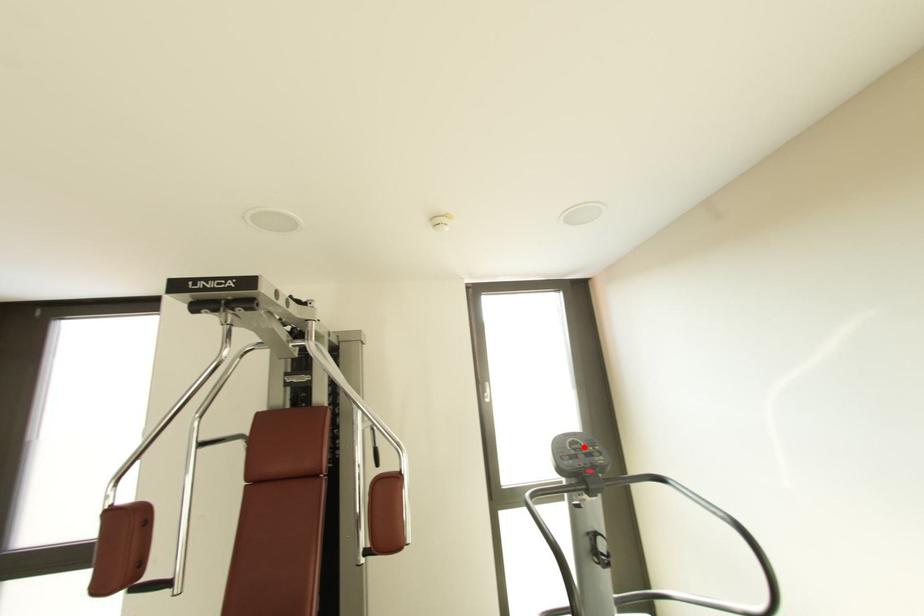
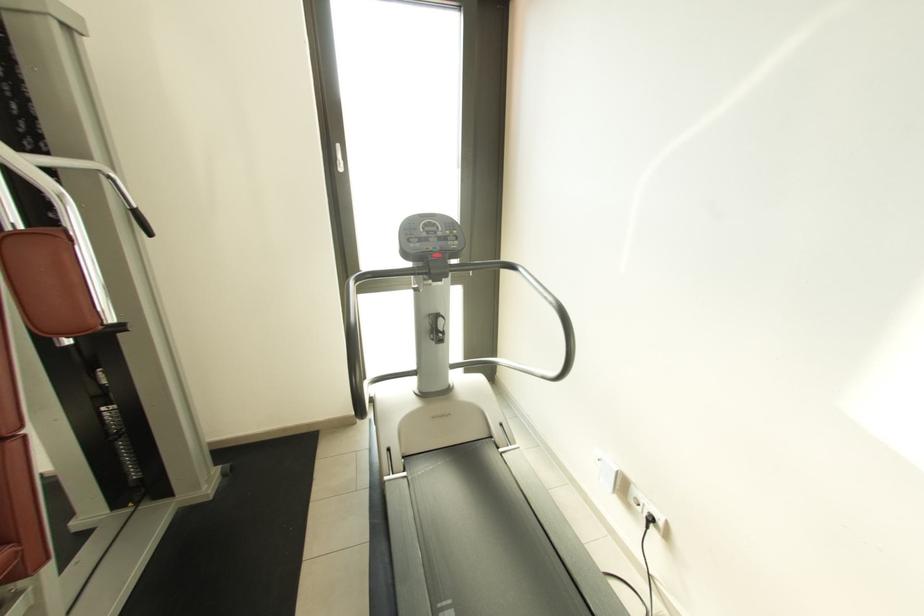
Question: I am providing you with two images of the same scene from different viewpoints. Given a red point in image1, look at the same physical point in image2. Is it:

Choices:
 (A) Closer to the viewpoint
 (B) Farther from the viewpoint

Answer: (A)